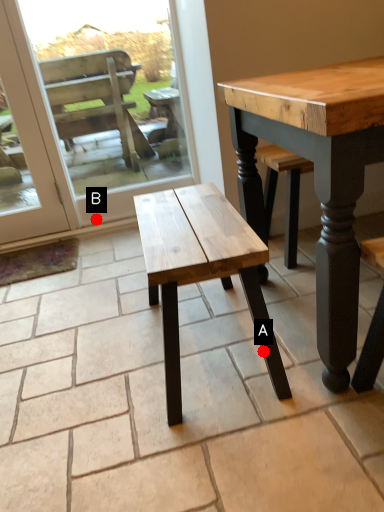
Question: Two points are circled on the image, labeled by A and B beside each circle. Among these points, which one is farthest from the camera?

Choices:
 (A) A is further
 (B) B is further

Answer: (B)